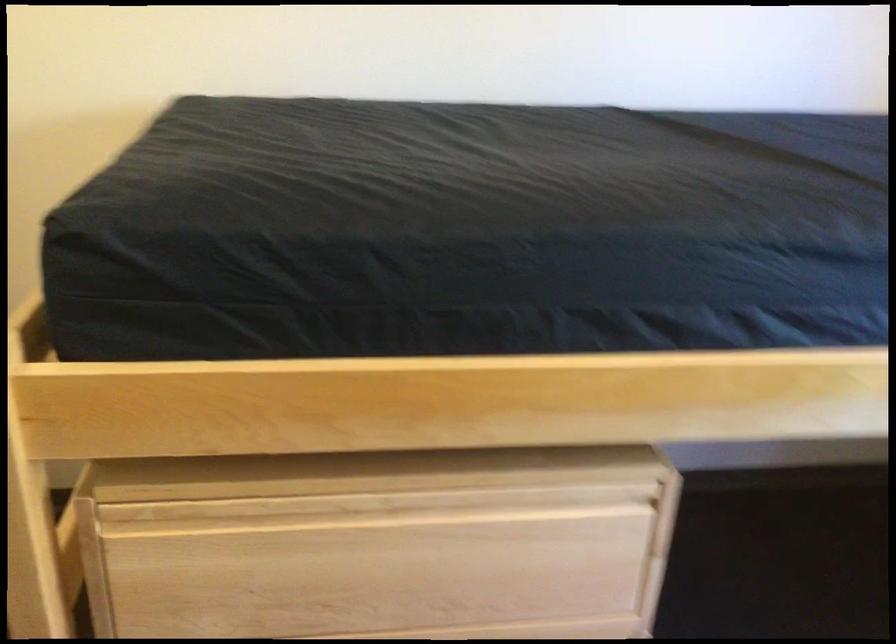
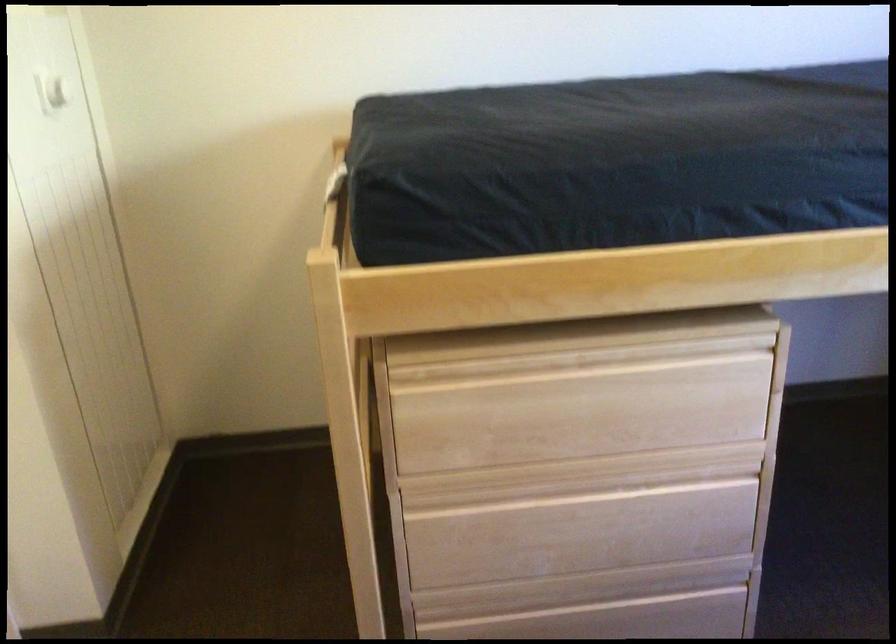
In the second image, find the point that corresponds to (469,529) in the first image.

(642, 377)